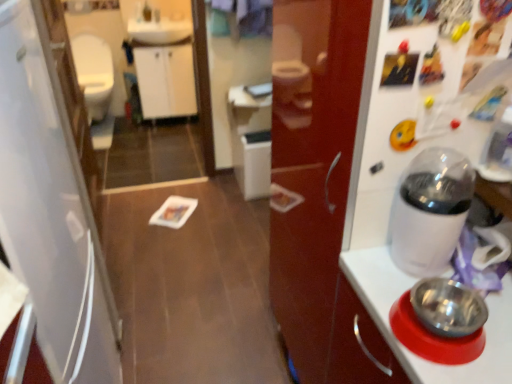
What do you see at coordinates (50, 209) in the screenshot? The height and width of the screenshot is (384, 512). I see `white matte refrigerator at left` at bounding box center [50, 209].

What are the coordinates of `white matte refrigerator at left` in the screenshot? It's located at (50, 209).

What is the approximate height of metallic stainless steel bowl at right?

The height of metallic stainless steel bowl at right is 2.61 inches.

What is the approximate width of white glossy sink at upper center?

The width of white glossy sink at upper center is 12.42 inches.

What do you see at coordinates (156, 15) in the screenshot?
I see `matte white faucet at upper center` at bounding box center [156, 15].

What is the approximate height of white glossy mirror at upper center?

1.22 meters.

I want to click on white matte refrigerator at left, so click(x=50, y=209).

Is white glossy coffee maker at right at the back of white glossy toilet bowl at left?

No, white glossy toilet bowl at left's orientation is not away from white glossy coffee maker at right.

Does white glossy toilet bowl at left lie in front of white glossy coffee maker at right?

No, white glossy toilet bowl at left is behind white glossy coffee maker at right.

Is white glossy toilet bowl at left spatially inside white glossy coffee maker at right, or outside of it?

The correct answer is: outside.

Where is `faucet located behind the white glossy toilet bowl at left`? The height and width of the screenshot is (384, 512). faucet located behind the white glossy toilet bowl at left is located at coordinates (156, 15).

Consider the image. What's the angular difference between matte white faucet at upper center and white glossy toilet bowl at left's facing directions?

They differ by 2.1 degrees in their facing directions.

Does point (157, 15) come farther from viewer compared to point (87, 65)?

No.

From a real-world perspective, is matte white faucet at upper center physically above white glossy toilet bowl at left?

Yes.

Could you tell me if matte white faucet at upper center is turned towards white glossy sink at upper center?

No.

Is matte white faucet at upper center wider than white glossy sink at upper center?

No, matte white faucet at upper center is not wider than white glossy sink at upper center.

Is matte white faucet at upper center completely or partially inside metallic stainless steel bowl at right?

No, metallic stainless steel bowl at right does not contain matte white faucet at upper center.

Can you confirm if metallic stainless steel bowl at right is positioned to the right of matte white faucet at upper center?

Yes, metallic stainless steel bowl at right is to the right of matte white faucet at upper center.

Could you tell me if metallic stainless steel bowl at right is facing matte white faucet at upper center?

No, metallic stainless steel bowl at right does not turn towards matte white faucet at upper center.

Considering the relative sizes of metallic stainless steel bowl at right and matte white faucet at upper center in the image provided, is metallic stainless steel bowl at right bigger than matte white faucet at upper center?

Yes.

From a real-world perspective, who is located lower, white matte refrigerator at left or white glossy mirror at upper center?

In real-world perspective, white glossy mirror at upper center is lower.

Considering the sizes of white matte refrigerator at left and white glossy mirror at upper center in the image, is white matte refrigerator at left taller or shorter than white glossy mirror at upper center?

Considering their sizes, white matte refrigerator at left has more height than white glossy mirror at upper center.

Is white matte refrigerator at left next to white glossy mirror at upper center?

white matte refrigerator at left and white glossy mirror at upper center are clearly separated.

Considering the sizes of white glossy mirror at upper center and white glossy toilet bowl at left in the image, is white glossy mirror at upper center taller or shorter than white glossy toilet bowl at left?

Considering their sizes, white glossy mirror at upper center has more height than white glossy toilet bowl at left.

Is white glossy mirror at upper center wider than white glossy toilet bowl at left?

No.

Based on their positions, is white glossy mirror at upper center located to the left or right of white glossy toilet bowl at left?

In the image, white glossy mirror at upper center appears on the right side of white glossy toilet bowl at left.

From a real-world perspective, between white glossy sink at upper center and matte white faucet at upper center, who is vertically lower?

From a 3D spatial view, white glossy sink at upper center is below.

From the image's perspective, is white glossy sink at upper center located above or below matte white faucet at upper center?

white glossy sink at upper center is situated lower than matte white faucet at upper center in the image.

Find the location of a particular element. The height and width of the screenshot is (384, 512). home appliance that is below the white glossy toilet bowl at left (from the image's perspective) is located at coordinates (431, 211).

At what (x,y) coordinates should I click in order to perform the action: click on faucet above the white glossy toilet bowl at left (from the image's perspective). Please return your answer as a coordinate pair (x, y). This screenshot has width=512, height=384. Looking at the image, I should click on (156, 15).

From the picture: When comparing their distances from white glossy sink at upper center, does metallic stainless steel bowl at right or white glossy toilet bowl at left seem further?

metallic stainless steel bowl at right is further to white glossy sink at upper center.

From the picture: Which object lies nearer to the anchor point white glossy sink at upper center, matte white faucet at upper center or white glossy toilet bowl at left?

matte white faucet at upper center.

In the scene shown: Looking at the image, which one is located further to white glossy coffee maker at right, matte white faucet at upper center or white matte refrigerator at left?

The object further to white glossy coffee maker at right is matte white faucet at upper center.

From the image, which object appears to be nearer to metallic stainless steel bowl at right, white glossy mirror at upper center or white glossy toilet bowl at left?

white glossy mirror at upper center is closer to metallic stainless steel bowl at right.

Looking at the image, which one is located closer to white matte refrigerator at left, matte white faucet at upper center or white glossy mirror at upper center?

The object closer to white matte refrigerator at left is white glossy mirror at upper center.

Considering their positions, is matte white faucet at upper center positioned further to white glossy sink at upper center than white glossy coffee maker at right?

white glossy coffee maker at right lies further to white glossy sink at upper center than the other object.

Considering their positions, is white glossy mirror at upper center positioned closer to white glossy toilet bowl at left than white matte refrigerator at left?

The object closer to white glossy toilet bowl at left is white glossy mirror at upper center.

From the picture: Considering their positions, is metallic stainless steel bowl at right positioned further to white glossy mirror at upper center than matte white faucet at upper center?

metallic stainless steel bowl at right is further to white glossy mirror at upper center.

Where is `sink between white glossy mirror at upper center and matte white faucet at upper center in the front-back direction`? The image size is (512, 384). sink between white glossy mirror at upper center and matte white faucet at upper center in the front-back direction is located at coordinates pos(160,20).

What are the coordinates of `home appliance between metallic stainless steel bowl at right and white glossy sink at upper center in the front-back direction` in the screenshot? It's located at (431, 211).

You are a GUI agent. You are given a task and a screenshot of the screen. Output one action in this format:
    pyautogui.click(x=<x>, y=<y>)
    Task: Click on the toilet bowl between metallic stainless steel bowl at right and white glossy sink at upper center in the front-back direction
    The image size is (512, 384).
    Given the screenshot: What is the action you would take?
    [94, 73]

At what (x,y) coordinates should I click in order to perform the action: click on home appliance between white matte refrigerator at left and white glossy sink at upper center from front to back. Please return your answer as a coordinate pair (x, y). Image resolution: width=512 pixels, height=384 pixels. Looking at the image, I should click on (431, 211).